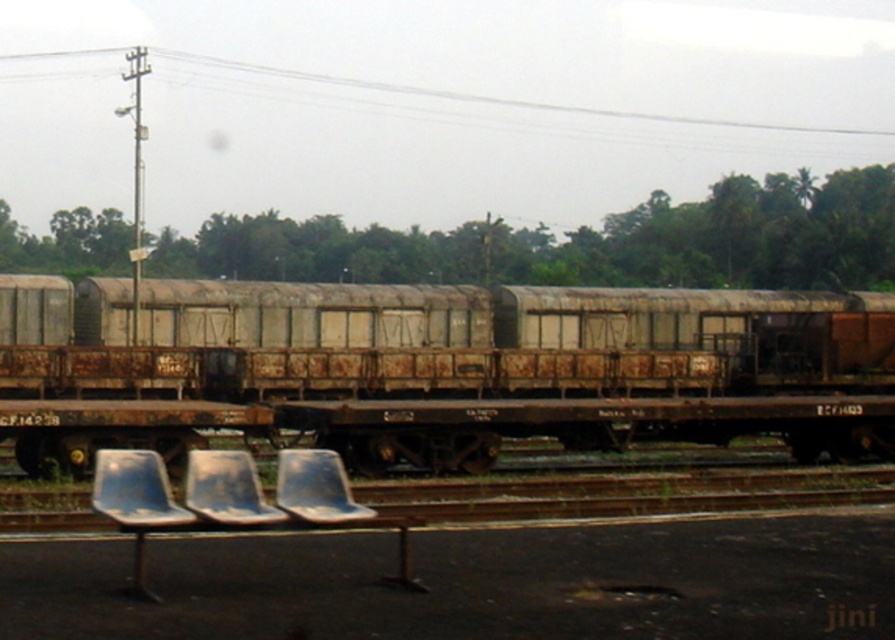
Looking at this image, you are a passenger waiting at the railway station. You see the rusty metal train car at center and the metallic gray chair at lower center. Which object is closer to you?

The rusty metal train car at center is closer to you because the metallic gray chair at lower center is behind it.